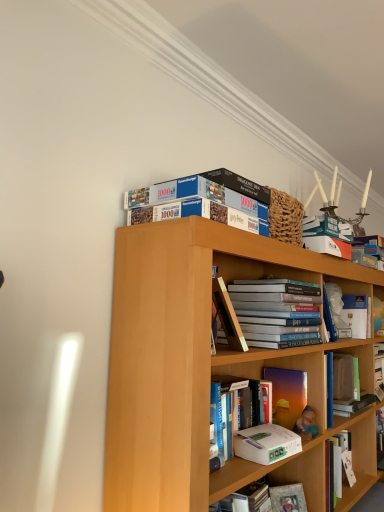
Question: Considering the positions of white matte book at center-right, marked as the 6th book in a left-to-right arrangement, and white matte paperback book at center, the first paperback book positioned from the top, in the image, is white matte book at center-right, marked as the 6th book in a left-to-right arrangement, wider or thinner than white matte paperback book at center, the first paperback book positioned from the top,?

Choices:
 (A) thin
 (B) wide

Answer: (B)

Question: From a real-world perspective, is white matte book at center-right, which appears as the first book when viewed from the right, above or below white matte paperback book at center, which is the second paperback book in back-to-front order?

Choices:
 (A) below
 (B) above

Answer: (B)

Question: Which object is the farthest from the blue cardboard puzzle at upper center, marked as the 1th book in a left-to-right arrangement?

Choices:
 (A) hardcover book at center, which ranks as the 2th book in left-to-right order
 (B) hardcover book at lower center, arranged as the second paperback book when viewed from the front
 (C) white matte paperback book at center, the 1th paperback book viewed from the front
 (D) white matte book at center-right, which appears as the first book when viewed from the right
 (E) hardcover book at center, which is the fourth book from right to left

Answer: (B)

Question: Which object is positioned farthest from the white matte paperback book at center, which ranks as the second paperback book in bottom-to-top order?

Choices:
 (A) blue cardboard puzzle at upper center, arranged as the sixth book when viewed from the right
 (B) hardcover book at center, positioned as the 3th book in left-to-right order
 (C) matte purple book at center, which appears as the second book when viewed from the right
 (D) hardcover book at lower center, acting as the first paperback book starting from the bottom
 (E) hardcover book at center, which ranks as the 2th book in left-to-right order

Answer: (A)